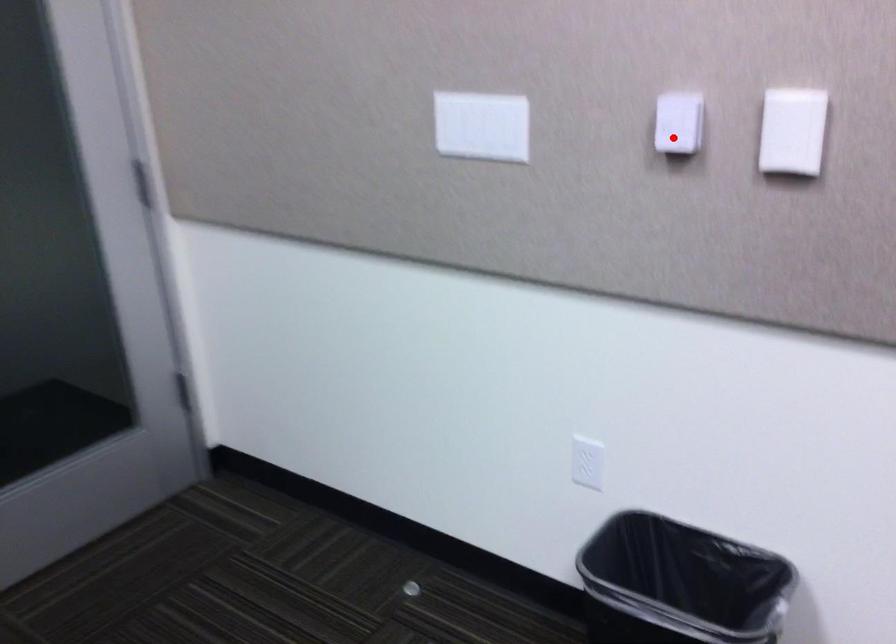
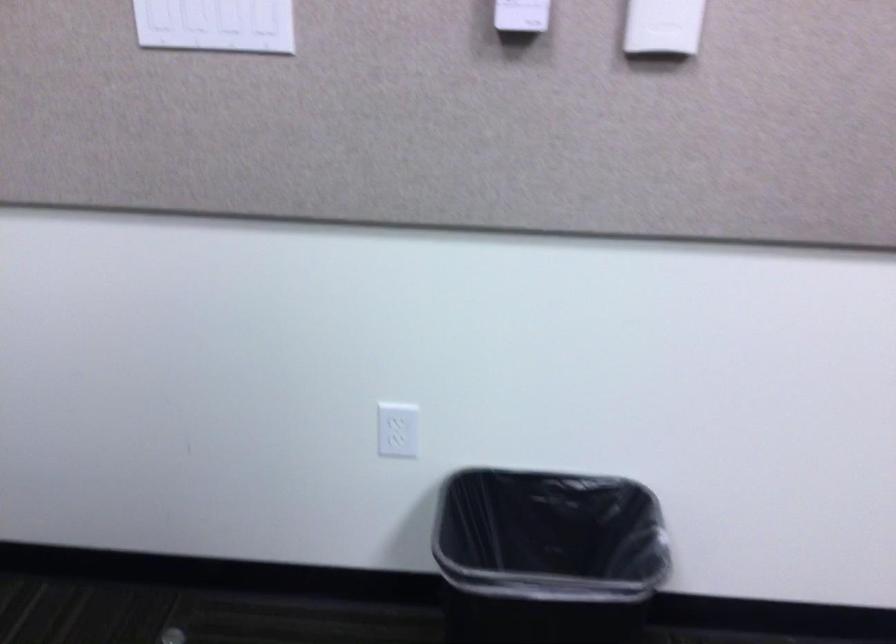
Question: I am providing you with two images of the same scene from different viewpoints. In image1, a red point is highlighted. Considering the same 3D point in image2, which of the following is correct?

Choices:
 (A) It is closer
 (B) It is farther

Answer: (A)